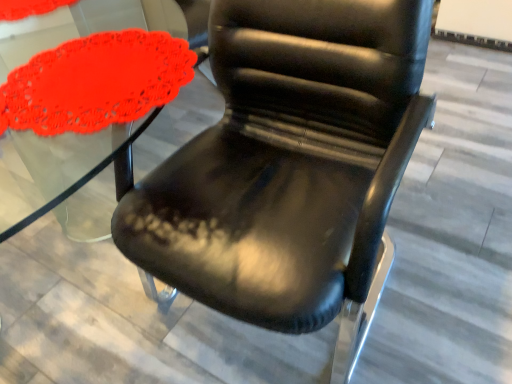
Question: Should I look upward or downward to see matte red doily at left?

Choices:
 (A) down
 (B) up

Answer: (B)

Question: Is matte red doily at left to the right of black leather chair at center from the viewer's perspective?

Choices:
 (A) no
 (B) yes

Answer: (A)

Question: From a real-world perspective, is matte red doily at left physically below black leather chair at center?

Choices:
 (A) yes
 (B) no

Answer: (B)

Question: Are matte red doily at left and black leather chair at center far apart?

Choices:
 (A) yes
 (B) no

Answer: (B)

Question: Is matte red doily at left wider than black leather chair at center?

Choices:
 (A) no
 (B) yes

Answer: (A)

Question: From the image's perspective, does matte red doily at left appear lower than black leather chair at center?

Choices:
 (A) no
 (B) yes

Answer: (A)

Question: Is matte red doily at left at the left side of black leather chair at center?

Choices:
 (A) no
 (B) yes

Answer: (B)

Question: Is black leather chair at center not close to matte red doily at left?

Choices:
 (A) yes
 (B) no

Answer: (B)

Question: Is black leather chair at center oriented towards matte red doily at left?

Choices:
 (A) no
 (B) yes

Answer: (A)

Question: From a real-world perspective, is black leather chair at center located higher than matte red doily at left?

Choices:
 (A) no
 (B) yes

Answer: (A)

Question: Can you confirm if black leather chair at center is wider than matte red doily at left?

Choices:
 (A) yes
 (B) no

Answer: (A)

Question: From the image's perspective, would you say black leather chair at center is positioned over matte red doily at left?

Choices:
 (A) yes
 (B) no

Answer: (B)

Question: Does black leather chair at center lie behind matte red doily at left?

Choices:
 (A) no
 (B) yes

Answer: (A)

Question: Relative to matte red doily at left, is black leather chair at center in front or behind?

Choices:
 (A) front
 (B) behind

Answer: (A)